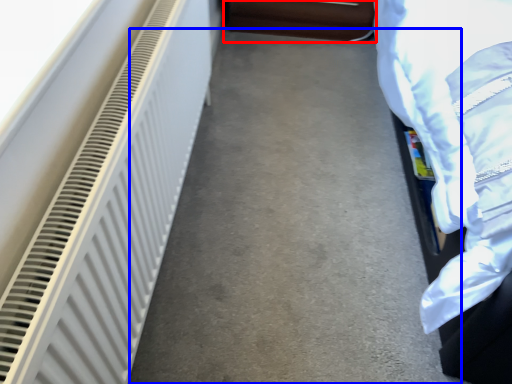
Question: Which point is closer to the camera, furniture (highlighted by a red box) or concrete (highlighted by a blue box)?

Choices:
 (A) furniture
 (B) concrete

Answer: (B)